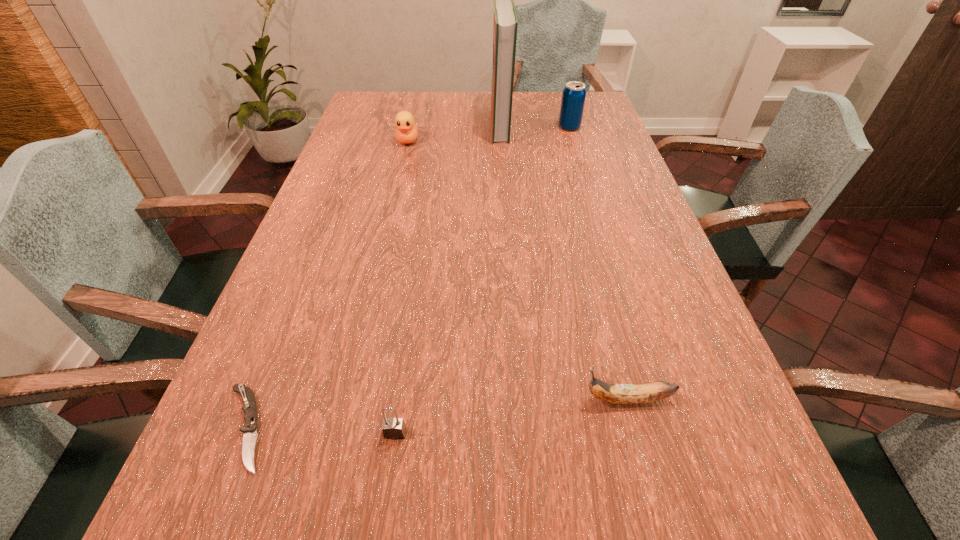
You are a GUI agent. You are given a task and a screenshot of the screen. Output one action in this format:
    pyautogui.click(x=<x>, y=<y>)
    Task: Click on the free space located 0.060m on the cover of the third object from right to left
    The height and width of the screenshot is (540, 960).
    Given the screenshot: What is the action you would take?
    pyautogui.click(x=472, y=126)

The height and width of the screenshot is (540, 960). Identify the location of free space located 0.180m on the back of the pop soda. (561, 100).

The image size is (960, 540). What are the coordinates of `vacant space located 0.180m on the face of the duckling` in the screenshot? It's located at (398, 180).

This screenshot has height=540, width=960. Identify the location of free point located at the stem of the banana. (473, 400).

Where is `vacant region located at the stem of the banana`? This screenshot has width=960, height=540. vacant region located at the stem of the banana is located at coordinates (485, 400).

The width and height of the screenshot is (960, 540). Find the location of `free space located at the stem of the banana`. free space located at the stem of the banana is located at coordinates point(394,400).

Locate an element on the screen. blank space located on the shackle of the third object from left to right is located at coordinates (x=383, y=521).

Find the location of `vacant space situated 0.190m on the back of the pocketknife`. vacant space situated 0.190m on the back of the pocketknife is located at coordinates (294, 306).

Find the location of `object located at the far edge`. object located at the far edge is located at coordinates (505, 24).

Locate an element on the screen. Image resolution: width=960 pixels, height=540 pixels. object located at the left edge is located at coordinates (249, 429).